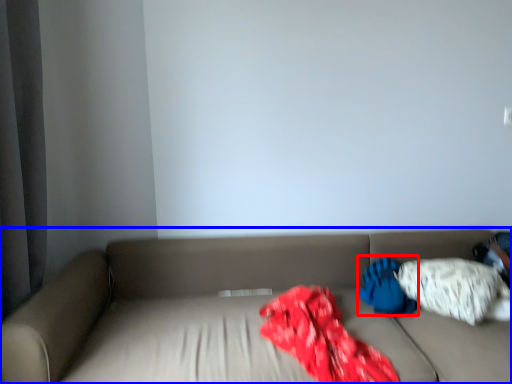
Question: Among these objects, which one is farthest to the camera, pillow (highlighted by a red box) or studio couch (highlighted by a blue box)?

Choices:
 (A) pillow
 (B) studio couch

Answer: (A)